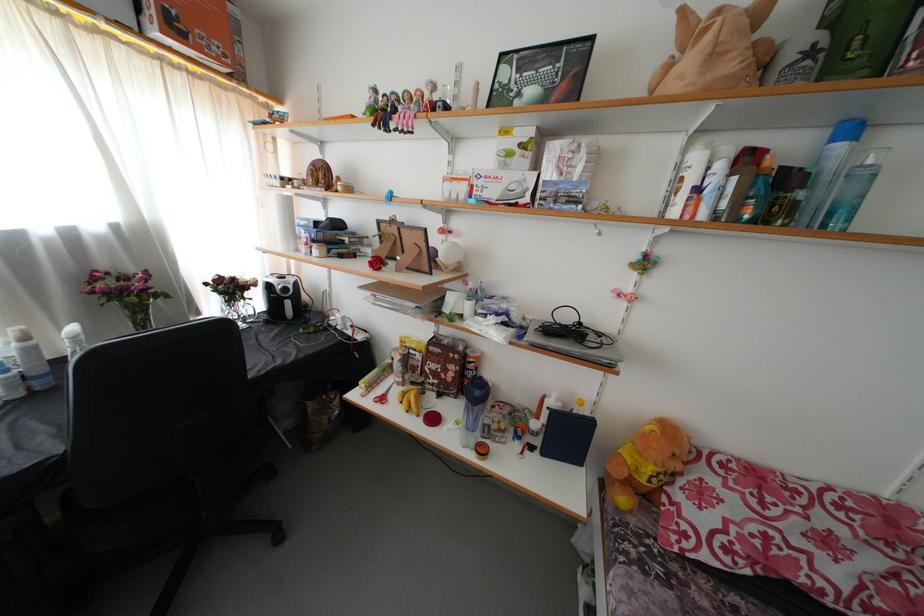
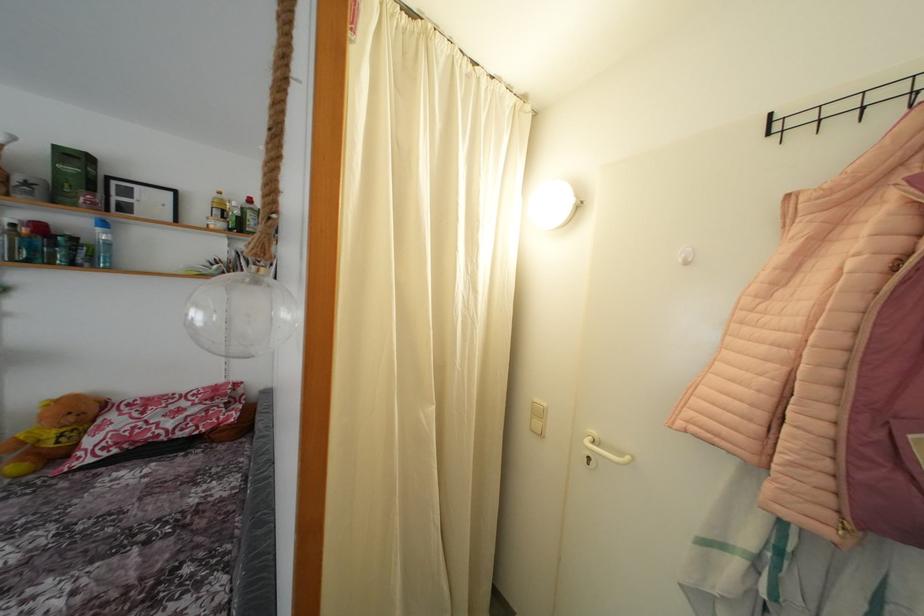
Where in the second image is the point corresponding to the point at 684,472 from the first image?

(77, 424)